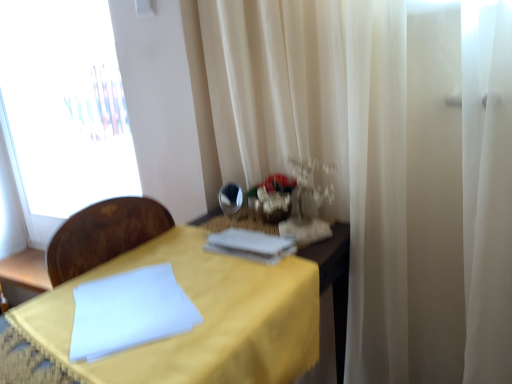
Where is `free location in front of white paper at center`? This screenshot has height=384, width=512. free location in front of white paper at center is located at coordinates (238, 281).